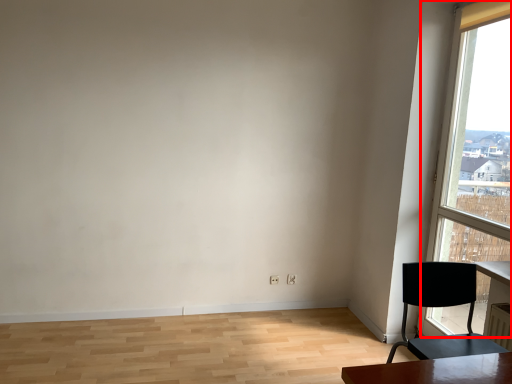
Question: From the image's perspective, what is the correct spatial relationship of window (annotated by the red box) in relation to chair?

Choices:
 (A) above
 (B) below

Answer: (A)